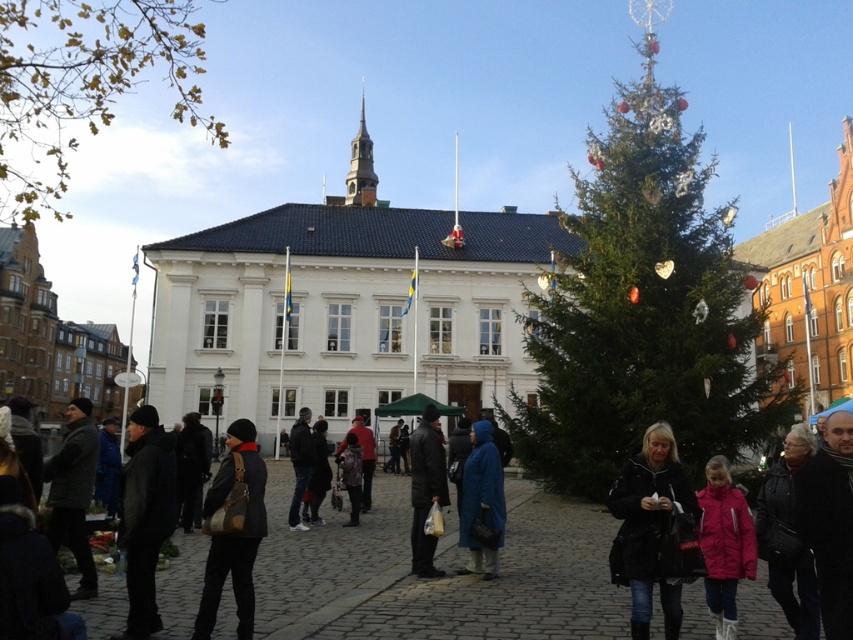
Who is positioned more to the right, black leather jacket at center or matte black jacket at center?

Positioned to the right is black leather jacket at center.

Looking at this image, which is below, black leather jacket at center or matte black jacket at center?

matte black jacket at center

Who is more forward, (616,481) or (218,545)?

Point (218,545)

Find the location of a particular element. This screenshot has width=853, height=640. black leather jacket at center is located at coordinates click(648, 528).

Is black leather jacket at center further to camera compared to dark gray jacket at center?

No, black leather jacket at center is in front of dark gray jacket at center.

Which is above, black leather jacket at center or dark gray jacket at center?

Positioned higher is black leather jacket at center.

Is point (660, 602) positioned after point (428, 550)?

No, it is not.

Locate an element on the screen. black leather jacket at center is located at coordinates (648, 528).

Between matte black jacket at center and dark gray jacket at center, which one is positioned higher?

dark gray jacket at center is higher up.

How far apart are matte black jacket at center and dark gray jacket at center?

The distance of matte black jacket at center from dark gray jacket at center is 11.52 meters.

Does point (236, 554) come in front of point (444, 480)?

Yes, point (236, 554) is in front of point (444, 480).

This screenshot has height=640, width=853. What are the coordinates of `matte black jacket at center` in the screenshot? It's located at (235, 544).